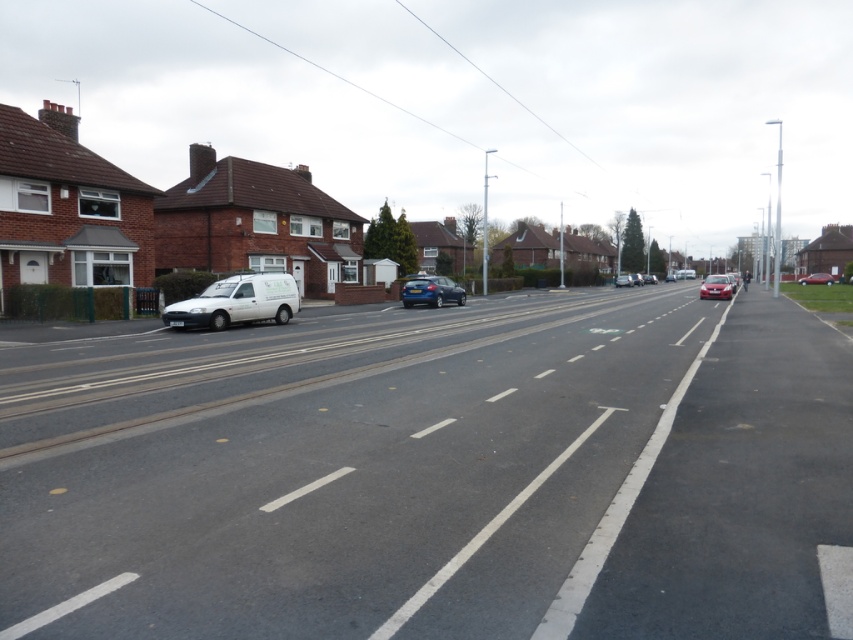
Question: Which object is farther from the camera taking this photo?

Choices:
 (A) white matte van at left
 (B) matte white van at center
 (C) metallic red car at center
 (D) shiny red sedan at center

Answer: (C)

Question: Can you confirm if metallic red car at center is positioned above matte black car at center?

Choices:
 (A) no
 (B) yes

Answer: (A)

Question: Among these points, which one is nearest to the camera?

Choices:
 (A) (271, 300)
 (B) (817, 282)
 (C) (627, 276)
 (D) (654, 280)

Answer: (A)

Question: Can you confirm if metallic red car at center is positioned to the left of matte white van at center?

Choices:
 (A) no
 (B) yes

Answer: (A)

Question: From the image, what is the correct spatial relationship of shiny red sedan at center in relation to metallic red car at center?

Choices:
 (A) left
 (B) right

Answer: (A)

Question: Which point is farther from the camera taking this photo?

Choices:
 (A) (424, 276)
 (B) (624, 275)

Answer: (B)